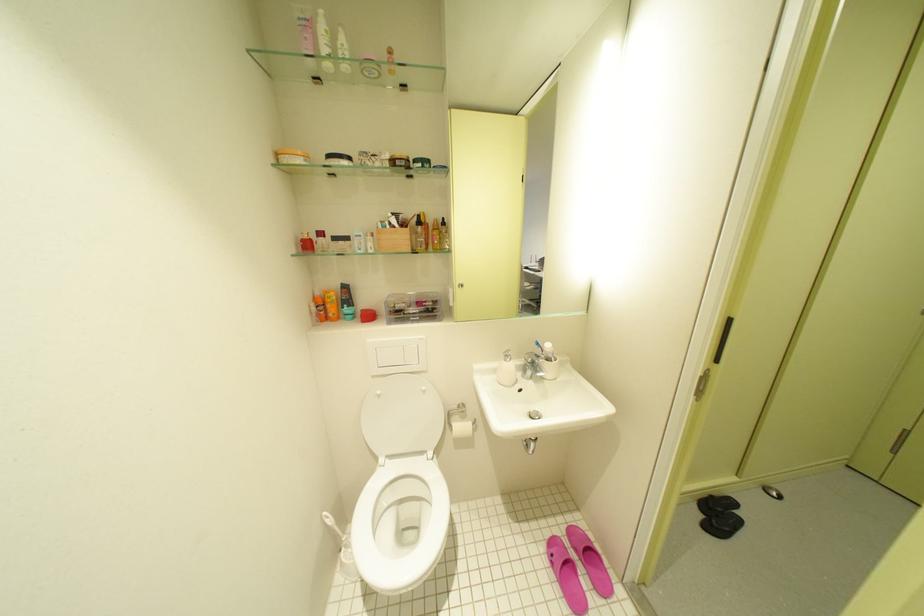
Identify the location of white toilet lid. The image size is (924, 616). (402, 416).